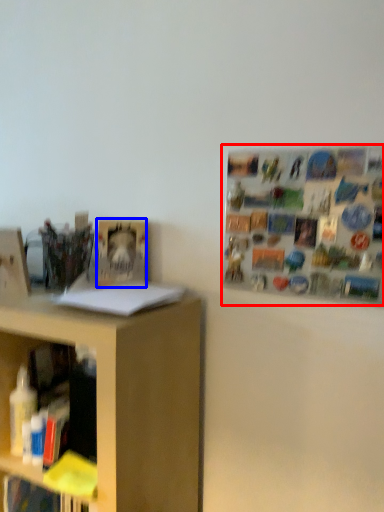
Question: Among these objects, which one is farthest to the camera, bulletin board (highlighted by a red box) or book (highlighted by a blue box)?

Choices:
 (A) bulletin board
 (B) book

Answer: (B)